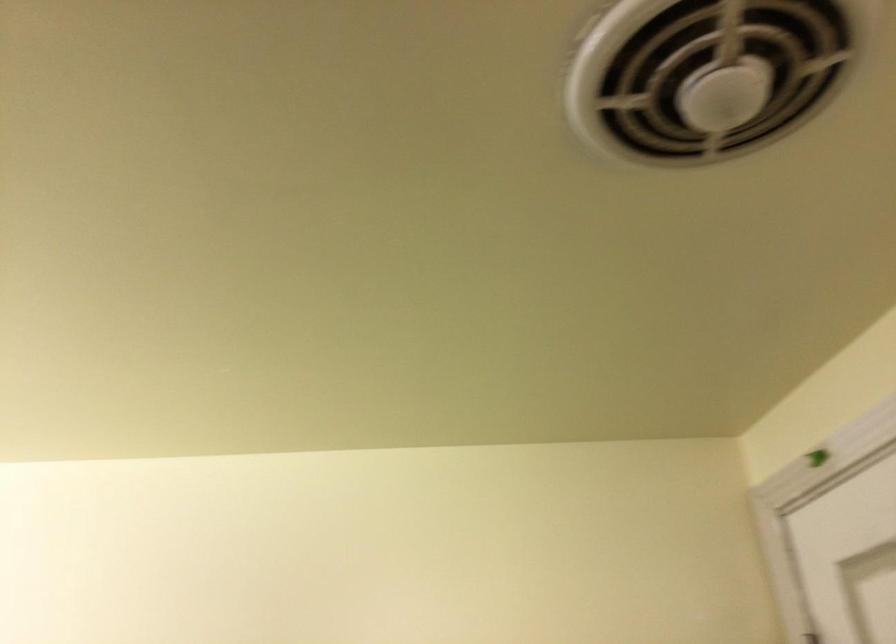
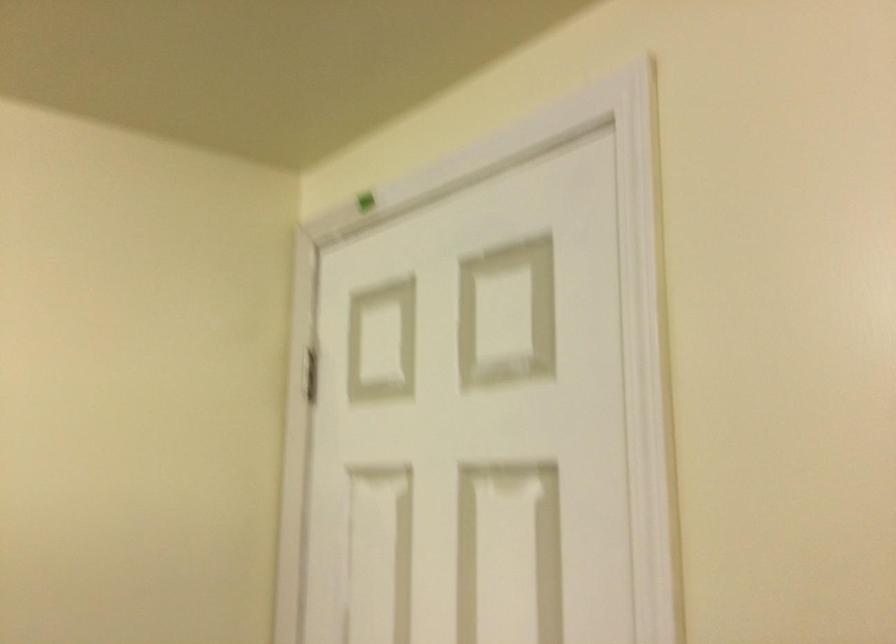
Question: The first image is from the beginning of the video and the second image is from the end. How did the camera likely rotate when shooting the video?

Choices:
 (A) Left
 (B) Right
 (C) Up
 (D) Down

Answer: (B)